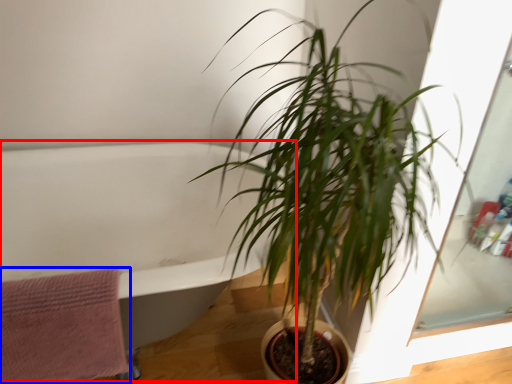
Question: Which object is closer to the camera taking this photo, bath (highlighted by a red box) or bath towel (highlighted by a blue box)?

Choices:
 (A) bath
 (B) bath towel

Answer: (A)